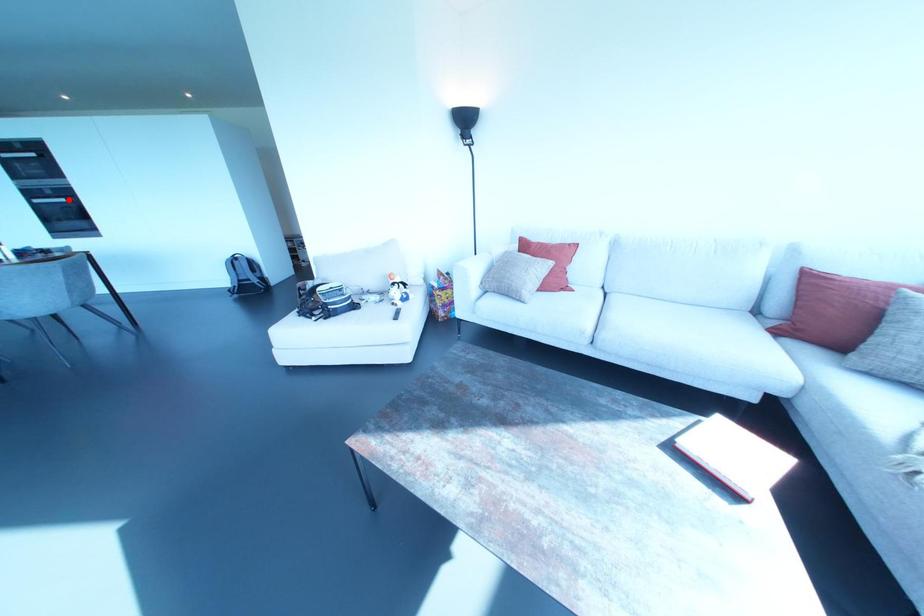
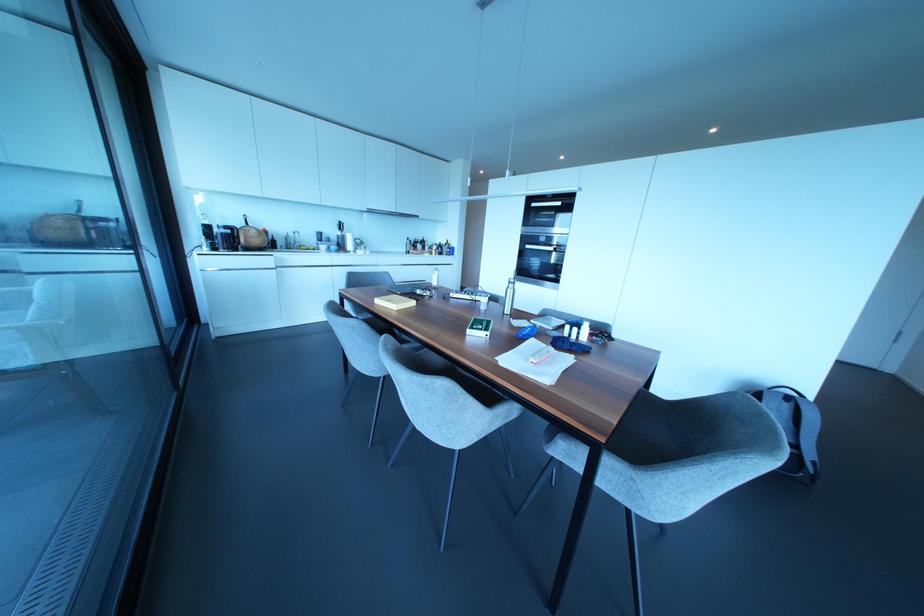
Where in the second image is the point corresponding to the highlighted location from the first image?

(553, 248)